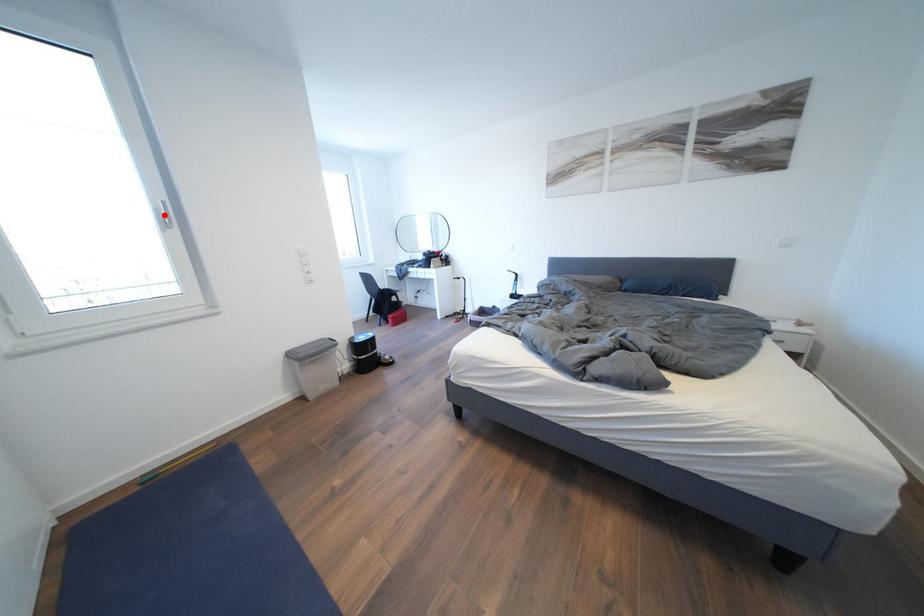
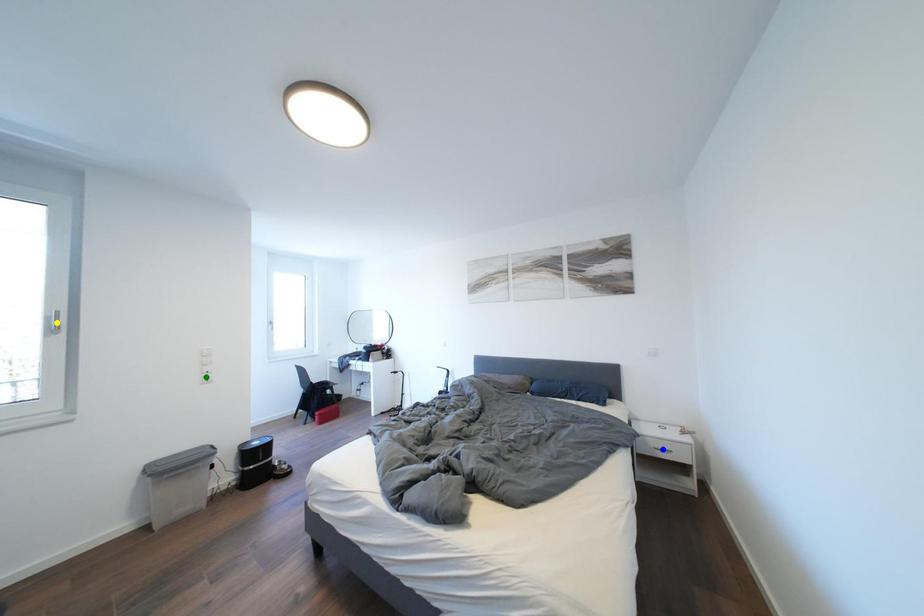
Question: I am providing you with two images of the same scene from different viewpoints. A red point is marked on the first image. You are given multiple points on the second image. Which mark in image 2 goes with the point in image 1?

Choices:
 (A) green point
 (B) blue point
 (C) yellow point

Answer: (C)